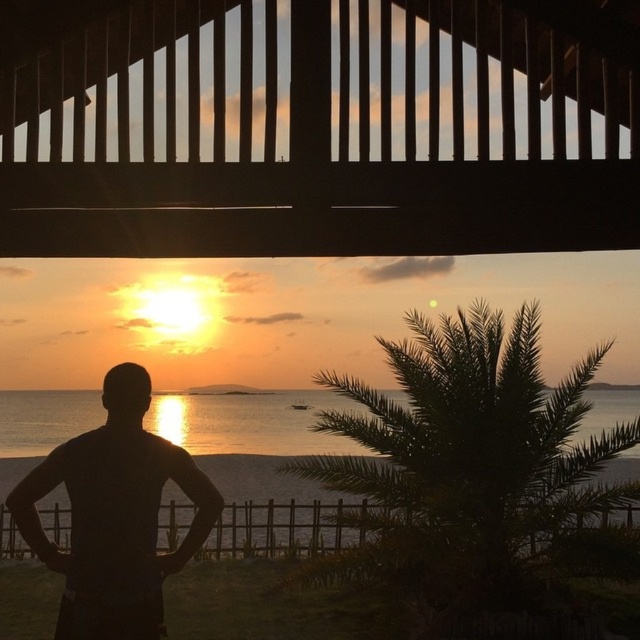
You are standing on the wooden structure with vertical slats and see the point at coordinates (257, 460). What is the object located at that point?

The point at coordinates (257, 460) corresponds to silvery water at center.

You are a photographer trying to capture the sunset from this wooden structure. You notice the black matte man at center and the brown wooden rail at lower center. Which object is positioned higher in the scene?

The black matte man at center is located above the brown wooden rail at lower center, so it is positioned higher in the scene.

You are standing on a wooden deck and want to take a photo of the sunset reflecting on the silvery water at center. However, there is a brown wooden rail at lower center in the way. Can you adjust your position to capture the reflection without the rail blocking the view?

The silvery water at center is located above the brown wooden rail at lower center, so you can lower your camera angle or crouch down to position it below the rail to capture the reflection without obstruction.